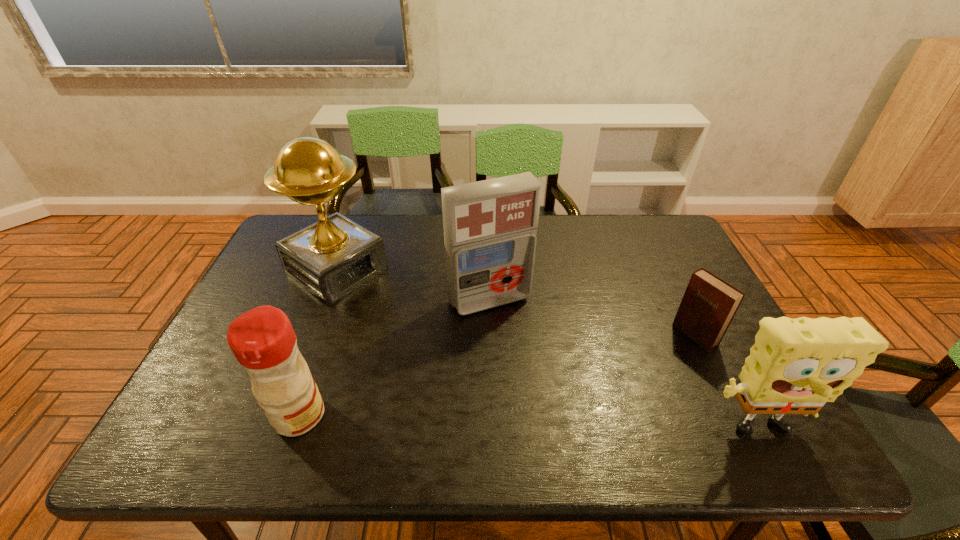
Locate an element on the screen. Image resolution: width=960 pixels, height=540 pixels. sponge positioned at the right edge is located at coordinates (796, 365).

You are a GUI agent. You are given a task and a screenshot of the screen. Output one action in this format:
    pyautogui.click(x=<x>, y=<y>)
    Task: Click on the diary that is at the right edge
    Image resolution: width=960 pixels, height=540 pixels.
    Given the screenshot: What is the action you would take?
    pyautogui.click(x=709, y=304)

In order to click on object present at the far left corner in this screenshot , I will do `click(331, 258)`.

This screenshot has width=960, height=540. In order to click on object that is at the near right corner in this screenshot , I will do `click(796, 365)`.

What are the coordinates of `vacant region at the far edge of the desktop` in the screenshot? It's located at (602, 220).

This screenshot has height=540, width=960. Identify the location of vacant space at the near edge. (469, 393).

Find the location of `blank space at the right edge`. blank space at the right edge is located at coordinates (676, 273).

What are the coordinates of `vacant space at the far left corner of the desktop` in the screenshot? It's located at (310, 219).

Locate an element on the screen. The image size is (960, 540). vacant space at the far right corner is located at coordinates (642, 254).

In the image, there is a desktop. Where is `vacant space at the near right corner`? The width and height of the screenshot is (960, 540). vacant space at the near right corner is located at coordinates (718, 406).